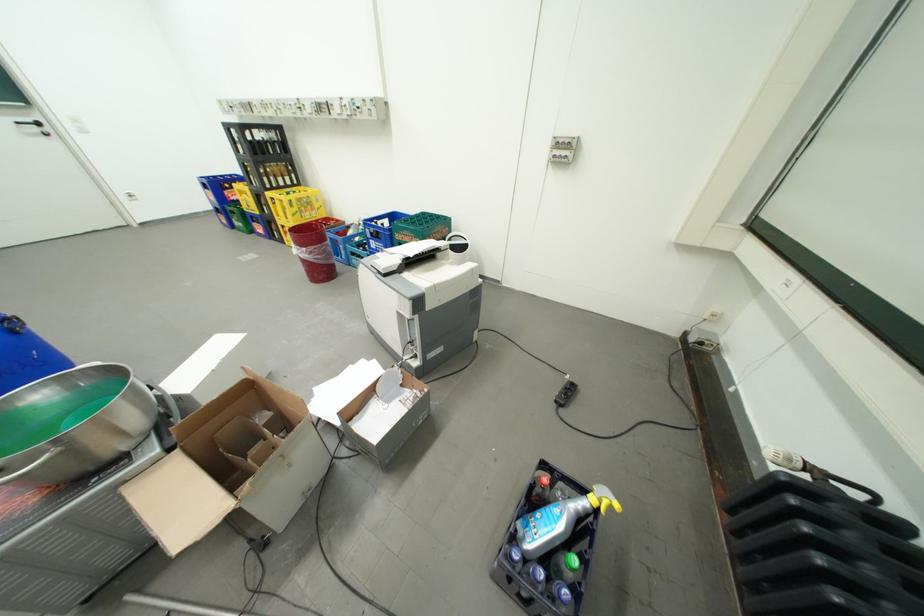
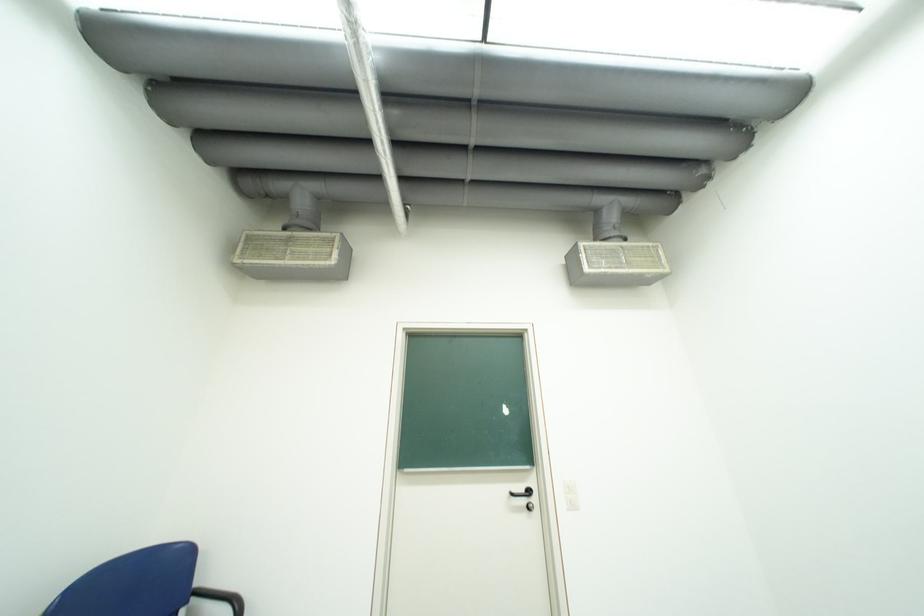
Where in the second image is the point corresponding to point (29, 124) from the first image?

(523, 495)